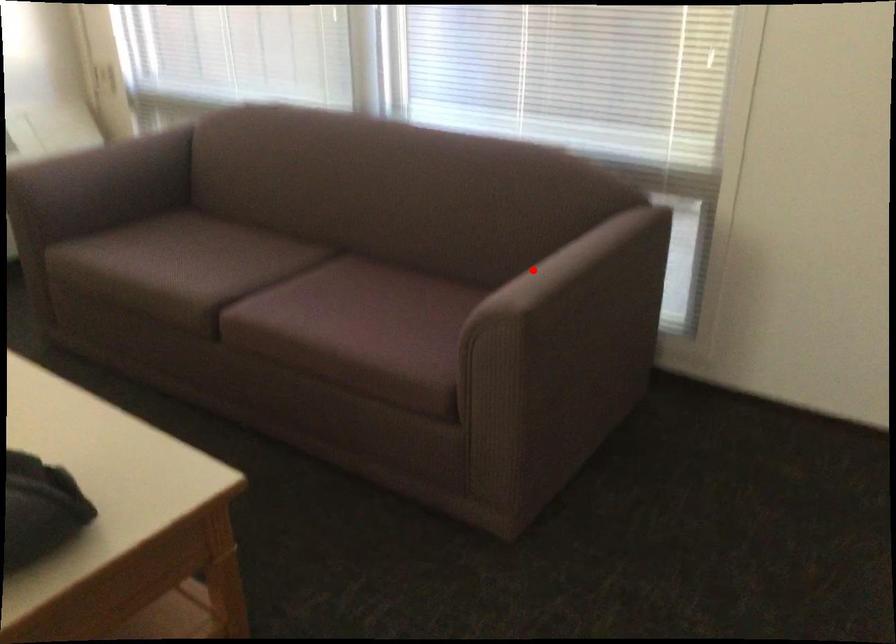
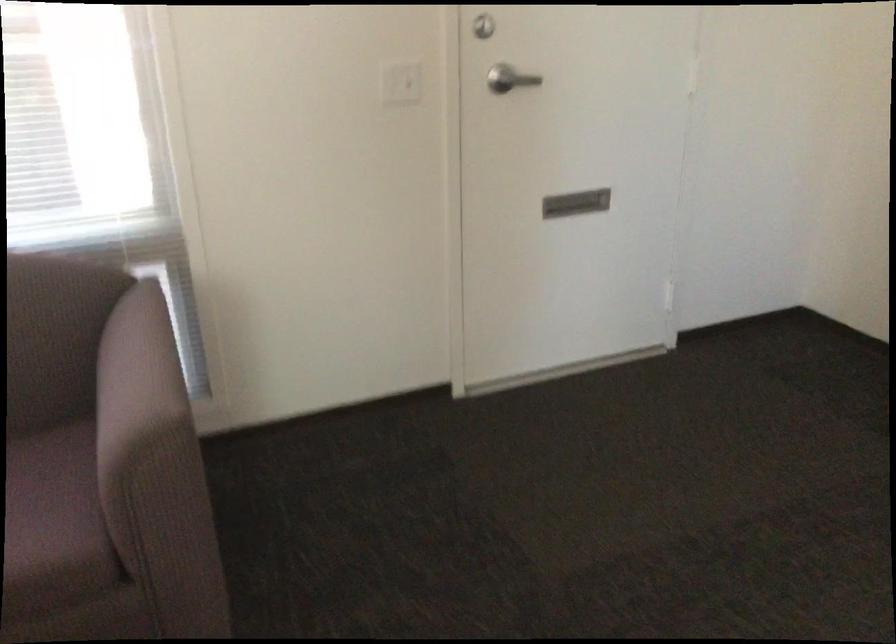
Locate, in the second image, the point that corresponds to the highlighted location in the first image.

(136, 381)